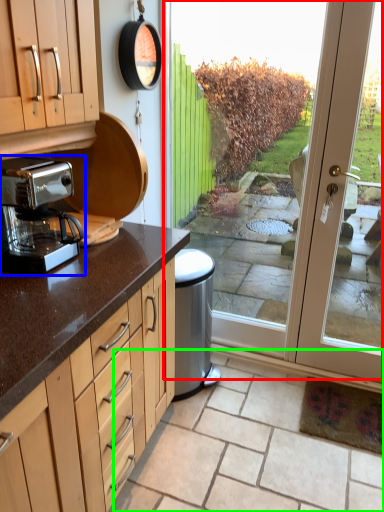
Question: Based on their relative distances, which object is nearer to screen door (highlighted by a red box)? Choose from coffee maker (highlighted by a blue box) and tile (highlighted by a green box).

Choices:
 (A) coffee maker
 (B) tile

Answer: (A)